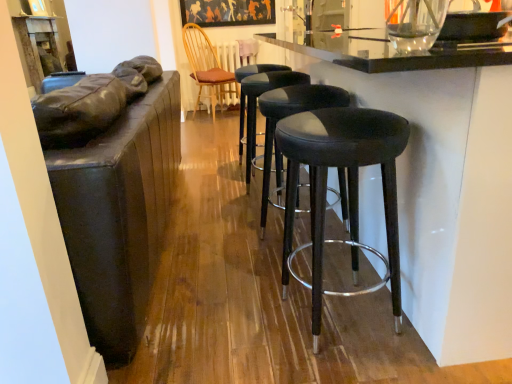
Question: Is matte black frame at upper center thinner than black leather stool at center, marked as the third stool in a front-to-back arrangement?

Choices:
 (A) yes
 (B) no

Answer: (A)

Question: Is black leather stool at center, marked as the third stool in a front-to-back arrangement, at the back of matte black frame at upper center?

Choices:
 (A) no
 (B) yes

Answer: (A)

Question: Is matte black frame at upper center bigger than black leather stool at center, marked as the third stool in a front-to-back arrangement?

Choices:
 (A) no
 (B) yes

Answer: (A)

Question: From the image's perspective, is matte black frame at upper center beneath black leather stool at center, the first stool when ordered from back to front?

Choices:
 (A) no
 (B) yes

Answer: (A)

Question: Is the depth of matte black frame at upper center greater than that of black leather stool at center, marked as the third stool in a front-to-back arrangement?

Choices:
 (A) no
 (B) yes

Answer: (B)

Question: Choose the correct answer: Is black leather bar stools at center inside black leather stool at center, which is the second stool from back to front, or outside it?

Choices:
 (A) inside
 (B) outside

Answer: (B)

Question: Is point (456, 342) closer or farther from the camera than point (263, 203)?

Choices:
 (A) closer
 (B) farther

Answer: (A)

Question: From a real-world perspective, is black leather bar stools at center above or below black leather stool at center, which is the second stool from back to front?

Choices:
 (A) below
 (B) above

Answer: (B)

Question: Considering the positions of black leather bar stools at center and black leather stool at center, which is the second stool from back to front, in the image, is black leather bar stools at center taller or shorter than black leather stool at center, which is the second stool from back to front,?

Choices:
 (A) short
 (B) tall

Answer: (B)

Question: Is matte black table at upper left taller or shorter than matte black stool at center, acting as the third stool starting from the back?

Choices:
 (A) short
 (B) tall

Answer: (B)

Question: From a real-world perspective, is matte black table at upper left positioned above or below matte black stool at center, acting as the third stool starting from the back?

Choices:
 (A) below
 (B) above

Answer: (B)

Question: Does point (36, 19) appear closer or farther from the camera than point (327, 137)?

Choices:
 (A) closer
 (B) farther

Answer: (B)

Question: Is matte black table at upper left to the left or to the right of matte black stool at center, the 1th stool viewed from the front, in the image?

Choices:
 (A) right
 (B) left

Answer: (B)

Question: Considering their positions, is black leather bar stools at center located in front of or behind wooden chair with cushion at center?

Choices:
 (A) behind
 (B) front

Answer: (B)

Question: In terms of height, does black leather bar stools at center look taller or shorter compared to wooden chair with cushion at center?

Choices:
 (A) short
 (B) tall

Answer: (A)